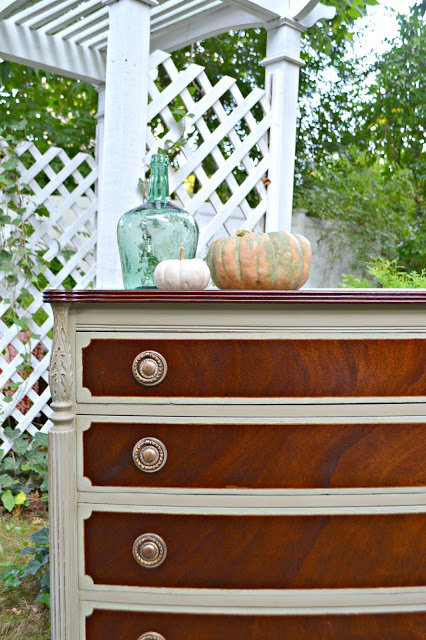
Where is `wooden furniture`? wooden furniture is located at coordinates (267, 317).